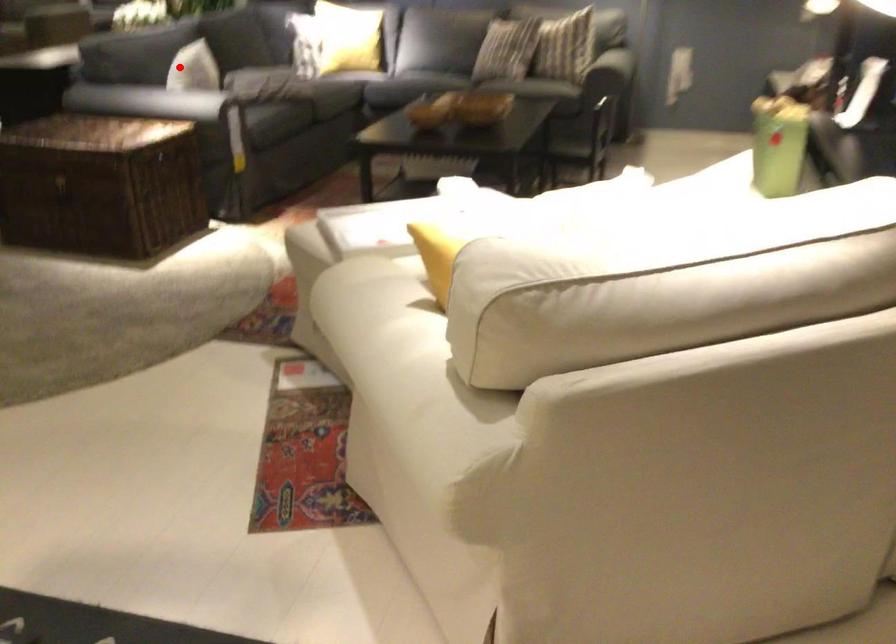
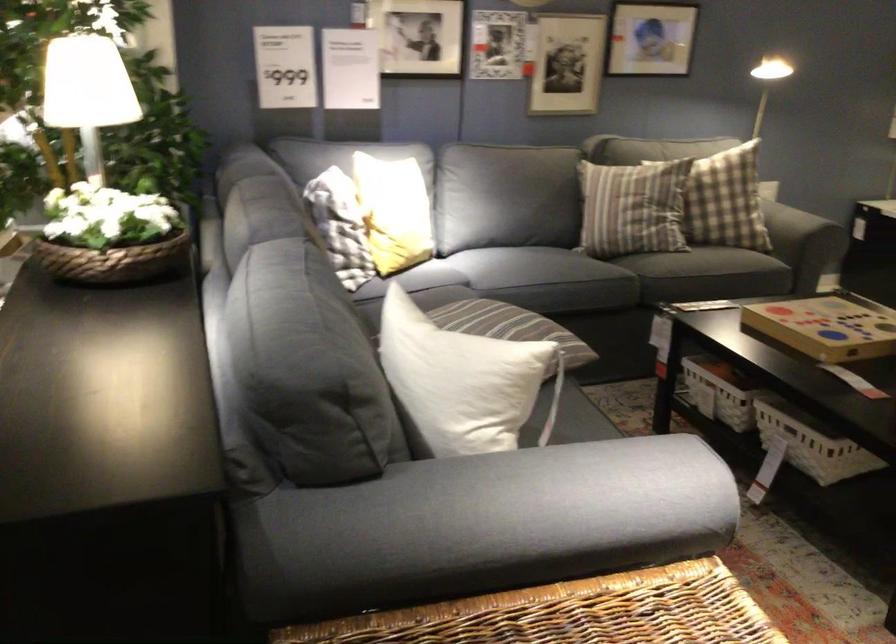
Locate, in the second image, the point that corresponds to the highlighted location in the first image.

(462, 381)